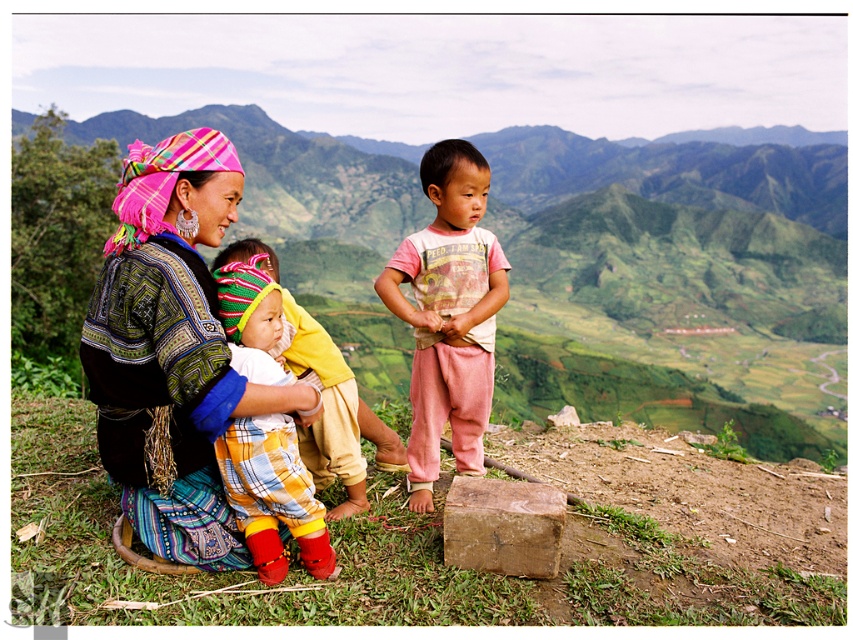
You are a photographer standing on the hilltop. You want to take a photo focusing on the matte black dress at center and pink cotton pants at center. Which object should you adjust your camera focus on first if you want to ensure both are in focus?

The matte black dress at center is closer to the viewer than the pink cotton pants at center, so you should focus on the matte black dress at center first to ensure both are in focus.

You are standing on the hilltop and want to walk towards the nearest point between point (155,493) and point (456,410). Which point should you head towards?

Point (155,493) is closer to the viewer than point (456,410), so you should head towards point (155,493).